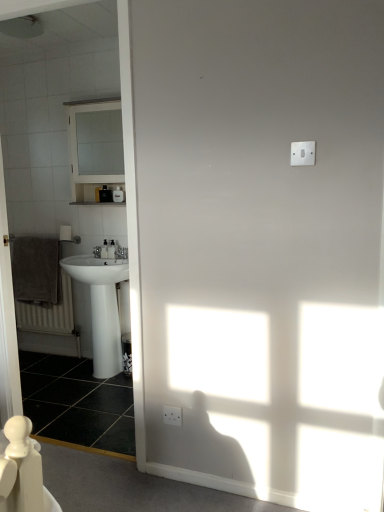
Identify the location of free space in front of brown textured towel at left. (45, 366).